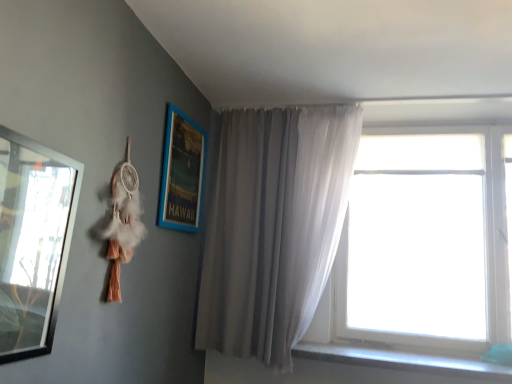
Locate an element on the screen. The height and width of the screenshot is (384, 512). gray concrete window sill at lower right is located at coordinates (402, 361).

What do you see at coordinates (402, 361) in the screenshot? I see `gray concrete window sill at lower right` at bounding box center [402, 361].

What are the coordinates of `blue wooden picture frame at upper left, which is the first picture frame from right to left` in the screenshot? It's located at (182, 173).

Measure the distance between gray fabric curtain at center and camera.

gray fabric curtain at center is 6.70 feet away from camera.

Find the location of a particular element. gray concrete window sill at lower right is located at coordinates (402, 361).

Find the location of a particular element. the 2nd picture frame to the left when counting from the gray concrete window sill at lower right is located at coordinates (33, 241).

Based on the photo, is metallic silver mirror at left, which ranks as the 1th picture frame in front-to-back order, in contact with gray concrete window sill at lower right?

No, metallic silver mirror at left, which ranks as the 1th picture frame in front-to-back order, is not in contact with gray concrete window sill at lower right.

Looking at their sizes, would you say metallic silver mirror at left, which appears as the 2th picture frame when viewed from the back, is wider or thinner than gray concrete window sill at lower right?

metallic silver mirror at left, which appears as the 2th picture frame when viewed from the back, is thinner than gray concrete window sill at lower right.

Between point (66, 168) and point (477, 377), which one is positioned behind?

Positioned behind is point (477, 377).

Image resolution: width=512 pixels, height=384 pixels. In order to click on the 1st picture frame counting from the left of the gray fabric curtain at center in this screenshot , I will do `click(182, 173)`.

Considering the positions of points (289, 148) and (197, 149), is point (289, 148) closer to camera compared to point (197, 149)?

No, (289, 148) is further to viewer.

Does gray fabric curtain at center have a lesser width compared to blue wooden picture frame at upper left, which is the second picture frame in left-to-right order?

Incorrect, the width of gray fabric curtain at center is not less than that of blue wooden picture frame at upper left, which is the second picture frame in left-to-right order.

Would you say gray fabric curtain at center is a long distance from blue wooden picture frame at upper left, which is the first picture frame from right to left?

No, gray fabric curtain at center is in close proximity to blue wooden picture frame at upper left, which is the first picture frame from right to left.

Is metallic silver mirror at left, which appears as the 2th picture frame when viewed from the back, inside gray fabric curtain at center?

Actually, metallic silver mirror at left, which appears as the 2th picture frame when viewed from the back, is outside gray fabric curtain at center.

Considering the points (316, 199) and (52, 213), which point is behind, point (316, 199) or point (52, 213)?

The point (316, 199) is behind.

Considering the relative positions of gray fabric curtain at center and metallic silver mirror at left, positioned as the second picture frame in right-to-left order, in the image provided, is gray fabric curtain at center behind metallic silver mirror at left, positioned as the second picture frame in right-to-left order,?

Yes, the depth of gray fabric curtain at center is greater than that of metallic silver mirror at left, positioned as the second picture frame in right-to-left order.

At what (x,y) coordinates should I click in order to perform the action: click on curtain that is behind the metallic silver mirror at left, which ranks as the 1th picture frame in front-to-back order. Please return your answer as a coordinate pair (x, y). Looking at the image, I should click on (273, 227).

Between blue wooden picture frame at upper left, acting as the first picture frame starting from the back, and gray fabric curtain at center, which one has smaller width?

blue wooden picture frame at upper left, acting as the first picture frame starting from the back.

Which is more to the left, blue wooden picture frame at upper left, which is the second picture frame in left-to-right order, or gray fabric curtain at center?

From the viewer's perspective, blue wooden picture frame at upper left, which is the second picture frame in left-to-right order, appears more on the left side.

Does blue wooden picture frame at upper left, which is the first picture frame from right to left, touch gray fabric curtain at center?

blue wooden picture frame at upper left, which is the first picture frame from right to left, is not next to gray fabric curtain at center, and they're not touching.

Locate an element on the screen. The height and width of the screenshot is (384, 512). picture frame above the gray fabric curtain at center (from a real-world perspective) is located at coordinates (182, 173).

Considering the positions of objects blue wooden picture frame at upper left, which is the first picture frame from right to left, and transparent glass window at right in the image provided, who is more to the left, blue wooden picture frame at upper left, which is the first picture frame from right to left, or transparent glass window at right?

From the viewer's perspective, blue wooden picture frame at upper left, which is the first picture frame from right to left, appears more on the left side.

Is blue wooden picture frame at upper left, the second picture frame viewed from the front, oriented away from transparent glass window at right?

blue wooden picture frame at upper left, the second picture frame viewed from the front, does not have its back to transparent glass window at right.

How much distance is there between blue wooden picture frame at upper left, which is the first picture frame from right to left, and transparent glass window at right?

blue wooden picture frame at upper left, which is the first picture frame from right to left, is 1.14 meters away from transparent glass window at right.

Find the location of a particular element. picture frame that is above the transparent glass window at right (from a real-world perspective) is located at coordinates (182, 173).

From the image's perspective, which object appears higher, gray concrete window sill at lower right or transparent glass window at right?

transparent glass window at right appears higher in the image.

Considering the sizes of objects gray concrete window sill at lower right and transparent glass window at right in the image provided, who is thinner, gray concrete window sill at lower right or transparent glass window at right?

transparent glass window at right.

Is gray concrete window sill at lower right touching transparent glass window at right?

No, gray concrete window sill at lower right is not touching transparent glass window at right.

From the picture: Could you tell me if metallic silver mirror at left, positioned as the second picture frame in right-to-left order, is turned towards gray fabric curtain at center?

No, metallic silver mirror at left, positioned as the second picture frame in right-to-left order, is not aimed at gray fabric curtain at center.

Considering the sizes of objects metallic silver mirror at left, which ranks as the 1th picture frame in front-to-back order, and gray fabric curtain at center in the image provided, who is wider, metallic silver mirror at left, which ranks as the 1th picture frame in front-to-back order, or gray fabric curtain at center?

Wider between the two is gray fabric curtain at center.

Does metallic silver mirror at left, positioned as the second picture frame in right-to-left order, have a larger size compared to gray fabric curtain at center?

No, metallic silver mirror at left, positioned as the second picture frame in right-to-left order, is not bigger than gray fabric curtain at center.

Is metallic silver mirror at left, the 1th picture frame when ordered from left to right, not close to gray fabric curtain at center?

Indeed, metallic silver mirror at left, the 1th picture frame when ordered from left to right, is not near gray fabric curtain at center.

Locate an element on the screen. This screenshot has width=512, height=384. the 2nd picture frame in front of the gray concrete window sill at lower right, counting from the anchor's position is located at coordinates 33,241.

The image size is (512, 384). I want to click on curtain on the right of blue wooden picture frame at upper left, acting as the first picture frame starting from the back, so click(x=273, y=227).

Considering their positions, is metallic silver mirror at left, positioned as the second picture frame in right-to-left order, positioned closer to transparent glass window at right than blue wooden picture frame at upper left, the second picture frame viewed from the front?

blue wooden picture frame at upper left, the second picture frame viewed from the front, is positioned closer to the anchor transparent glass window at right.

Looking at the image, which one is located closer to gray concrete window sill at lower right, metallic silver mirror at left, which appears as the 2th picture frame when viewed from the back, or gray fabric curtain at center?

Among the two, gray fabric curtain at center is located nearer to gray concrete window sill at lower right.

When comparing their distances from gray concrete window sill at lower right, does blue wooden picture frame at upper left, acting as the first picture frame starting from the back, or gray fabric curtain at center seem further?

Among the two, blue wooden picture frame at upper left, acting as the first picture frame starting from the back, is located further to gray concrete window sill at lower right.

Looking at the image, which one is located closer to metallic silver mirror at left, positioned as the second picture frame in right-to-left order, blue wooden picture frame at upper left, the second picture frame viewed from the front, or gray concrete window sill at lower right?

Based on the image, blue wooden picture frame at upper left, the second picture frame viewed from the front, appears to be nearer to metallic silver mirror at left, positioned as the second picture frame in right-to-left order.

Based on their spatial positions, is blue wooden picture frame at upper left, the second picture frame viewed from the front, or transparent glass window at right further from metallic silver mirror at left, which appears as the 2th picture frame when viewed from the back?

Among the two, transparent glass window at right is located further to metallic silver mirror at left, which appears as the 2th picture frame when viewed from the back.

Considering their positions, is blue wooden picture frame at upper left, which is the first picture frame from right to left, positioned further to gray fabric curtain at center than transparent glass window at right?

Based on the image, transparent glass window at right appears to be further to gray fabric curtain at center.

Consider the image. When comparing their distances from gray concrete window sill at lower right, does blue wooden picture frame at upper left, acting as the first picture frame starting from the back, or transparent glass window at right seem closer?

Based on the image, transparent glass window at right appears to be nearer to gray concrete window sill at lower right.

Considering their positions, is gray fabric curtain at center positioned closer to transparent glass window at right than blue wooden picture frame at upper left, acting as the first picture frame starting from the back?

gray fabric curtain at center is positioned closer to the anchor transparent glass window at right.

This screenshot has height=384, width=512. Find the location of `window sill between metallic silver mirror at left, the 1th picture frame when ordered from left to right, and transparent glass window at right, in the horizontal direction`. window sill between metallic silver mirror at left, the 1th picture frame when ordered from left to right, and transparent glass window at right, in the horizontal direction is located at coordinates pos(402,361).

This screenshot has width=512, height=384. What are the coordinates of `curtain between blue wooden picture frame at upper left, acting as the first picture frame starting from the back, and transparent glass window at right, in the horizontal direction` in the screenshot? It's located at (273, 227).

Identify the location of window sill between gray fabric curtain at center and transparent glass window at right in the horizontal direction. (402, 361).

Image resolution: width=512 pixels, height=384 pixels. In order to click on picture frame positioned between metallic silver mirror at left, positioned as the second picture frame in right-to-left order, and gray fabric curtain at center from near to far in this screenshot , I will do `click(182, 173)`.